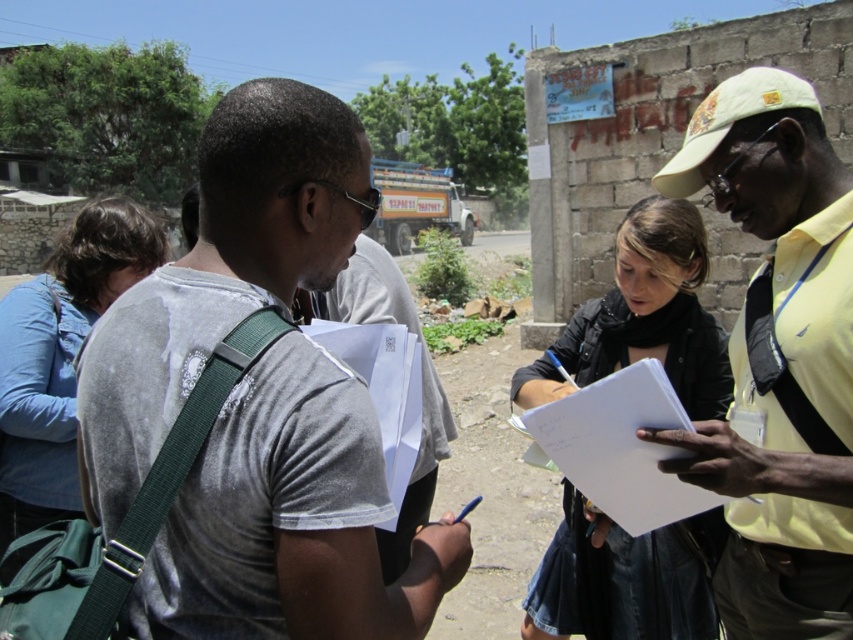
Question: Can you confirm if black leather jacket at center is thinner than white paper clipboard at center?

Choices:
 (A) yes
 (B) no

Answer: (B)

Question: Among these objects, which one is nearest to the camera?

Choices:
 (A) white paper clipboard at center
 (B) gray cotton t-shirt at center
 (C) yellow fabric shirt at right

Answer: (B)

Question: Does yellow fabric shirt at right have a lesser width compared to white paper clipboard at center?

Choices:
 (A) no
 (B) yes

Answer: (A)

Question: Can you confirm if gray cotton t-shirt at center is positioned to the right of blue denim jacket at left?

Choices:
 (A) yes
 (B) no

Answer: (A)

Question: Which object appears closest to the camera in this image?

Choices:
 (A) black leather jacket at center
 (B) gray cotton t-shirt at center

Answer: (B)

Question: Which point appears closest to the camera in this image?

Choices:
 (A) (698, 280)
 (B) (19, 413)
 (C) (165, 310)

Answer: (C)